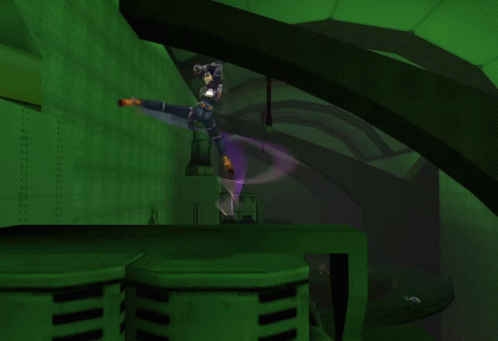
At what (x,y) coordinates should I click in order to perform the action: click on beam. Please return your answer as a coordinate pair (x, y). Looking at the image, I should click on (407, 85), (343, 177), (308, 185).